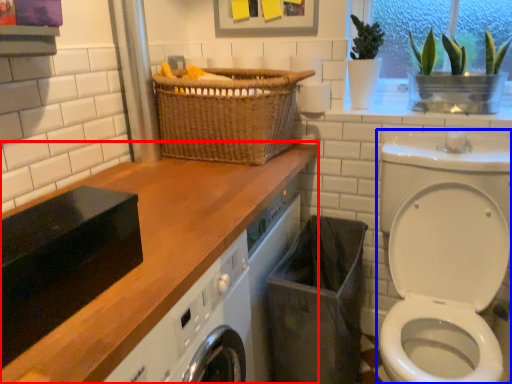
Question: Which object appears farthest to the camera in this image, countertop (highlighted by a red box) or washer (highlighted by a blue box)?

Choices:
 (A) countertop
 (B) washer

Answer: (B)